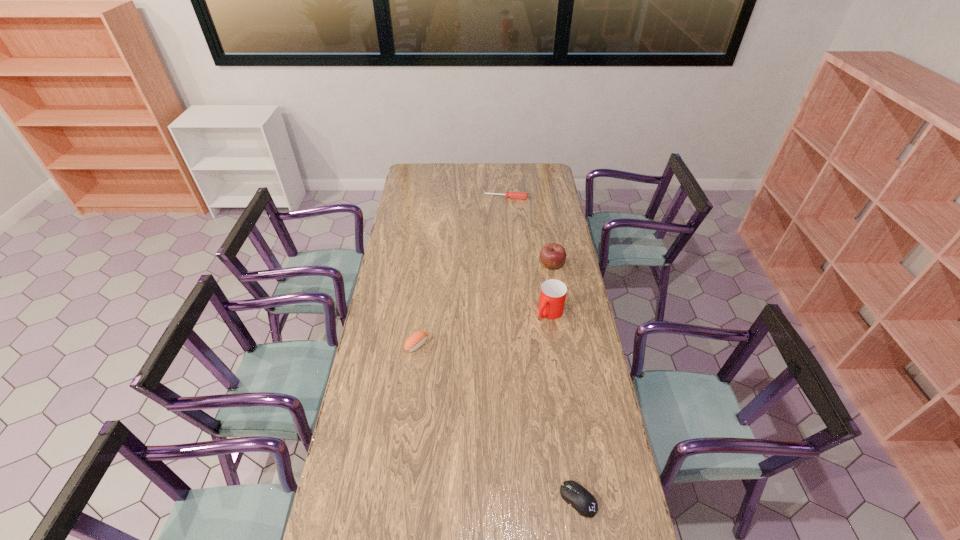
This screenshot has width=960, height=540. I want to click on the leftmost object, so click(x=417, y=339).

I want to click on the fourth farthest object, so click(x=417, y=339).

The image size is (960, 540). I want to click on the nearest object, so click(574, 494).

At what (x,y) coordinates should I click in order to perform the action: click on the third nearest object. Please return your answer as a coordinate pair (x, y). This screenshot has height=540, width=960. Looking at the image, I should click on (553, 293).

The width and height of the screenshot is (960, 540). In order to click on cup in this screenshot , I will do `click(553, 293)`.

Find the location of `apple`. apple is located at coordinates (552, 255).

Identify the location of the fourth nearest object. The height and width of the screenshot is (540, 960). (552, 255).

Where is `the farthest object`? The width and height of the screenshot is (960, 540). the farthest object is located at coordinates (515, 195).

You are a GUI agent. You are given a task and a screenshot of the screen. Output one action in this format:
    pyautogui.click(x=<x>, y=<y>)
    Task: Click on the vacant space located 0.390m on the back of the third shortest object
    
    Given the screenshot: What is the action you would take?
    pyautogui.click(x=426, y=271)

Find the location of a particular element. vacant position located 0.180m on the left of the nearest object is located at coordinates (503, 500).